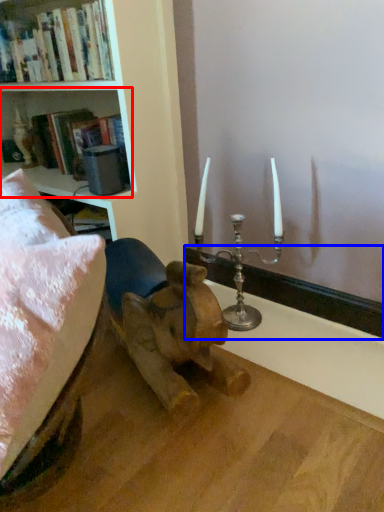
Question: Among these objects, which one is farthest to the camera, shelf (highlighted by a red box) or window sill (highlighted by a blue box)?

Choices:
 (A) shelf
 (B) window sill

Answer: (A)